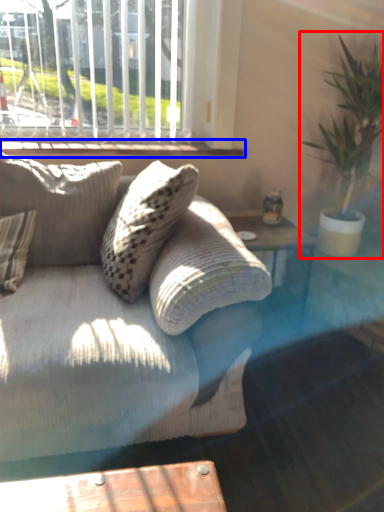
Question: Among these objects, which one is nearest to the camera, houseplant (highlighted by a red box) or window sill (highlighted by a blue box)?

Choices:
 (A) houseplant
 (B) window sill

Answer: (A)